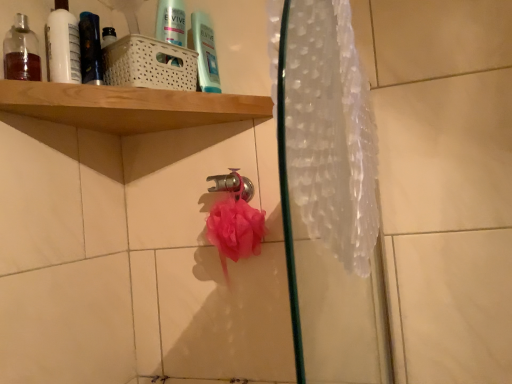
Question: Based on their positions, is wooden shelf at upper left located to the left or right of translucent plastic shower curtain at right?

Choices:
 (A) right
 (B) left

Answer: (B)

Question: In terms of size, does wooden shelf at upper left appear bigger or smaller than translucent plastic shower curtain at right?

Choices:
 (A) small
 (B) big

Answer: (B)

Question: Estimate the real-world distances between objects in this image. Which object is closer to the translucent glass bottle at upper left, positioned as the 2th mouthwash in back-to-front order?

Choices:
 (A) translucent plastic shower curtain at right
 (B) metallic silver faucet at center
 (C) wooden shelf at upper left
 (D) white glossy bottle at upper left, which is the 1th mouthwash from back to front
 (E) shiny black bottle at upper left

Answer: (D)

Question: Estimate the real-world distances between objects in this image. Which object is farther from the white glossy bottle at upper left, placed as the second mouthwash when sorted from front to back?

Choices:
 (A) translucent plastic shower curtain at right
 (B) metallic silver faucet at center
 (C) pink mesh sponge at center
 (D) wooden shelf at upper left
 (E) translucent glass bottle at upper left, positioned as the 2th mouthwash in back-to-front order

Answer: (A)